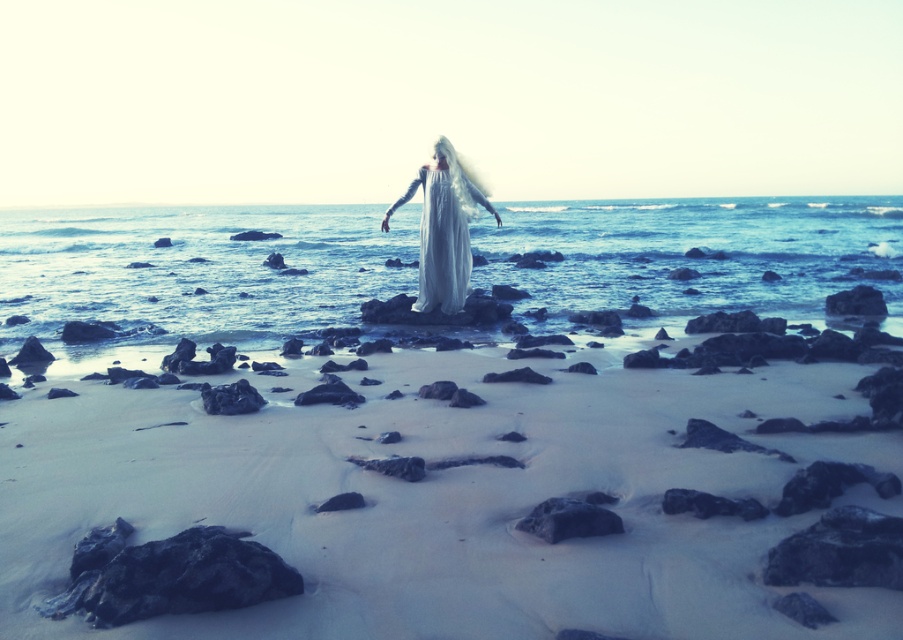
You are a photographer planning to capture the reflection of the white sand at center and the white silk dress at center in the calm ocean water. Which object would have a clearer reflection, and why?

The white sand at center would have a clearer reflection because it has a smaller size compared to the white silk dress at center, making it easier to capture finer details in the reflection.

You are a photographer planning to take a portrait of a model wearing the white silk dress at center. The dress is located at coordinates point 0.358, 0.492. To ensure the dress is the main focus, you want to position it in the center of the frame. Is the dress already centered according to the given coordinates?

The white silk dress at center is already positioned at the center of the frame since the coordinates point [443,228] indicate its central location.